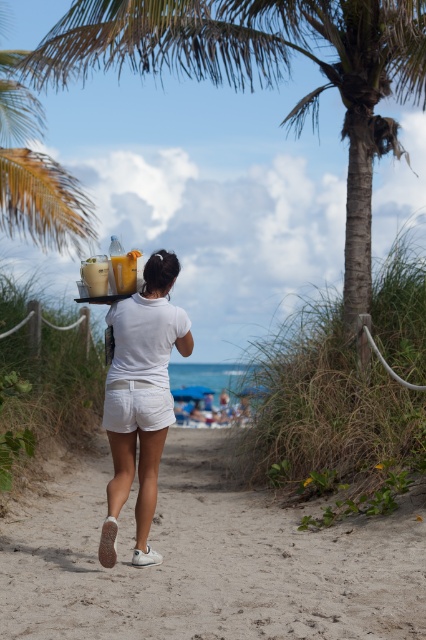
Can you confirm if green leafy palm tree at center is positioned to the left of white matte shorts at center?

No, green leafy palm tree at center is not to the left of white matte shorts at center.

The width and height of the screenshot is (426, 640). What do you see at coordinates (245, 122) in the screenshot?
I see `green leafy palm tree at center` at bounding box center [245, 122].

The image size is (426, 640). I want to click on green leafy palm tree at center, so click(x=245, y=122).

From the picture: Who is more distant from viewer, (149, 476) or (150, 275)?

The point (149, 476) is behind.

Find the location of a particular element. white matte shorts at center is located at coordinates (141, 400).

From the picture: Which is more to the right, green leafy palm tree at center or white cotton shorts at lower center?

From the viewer's perspective, green leafy palm tree at center appears more on the right side.

This screenshot has height=640, width=426. What are the coordinates of `green leafy palm tree at center` in the screenshot? It's located at (245, 122).